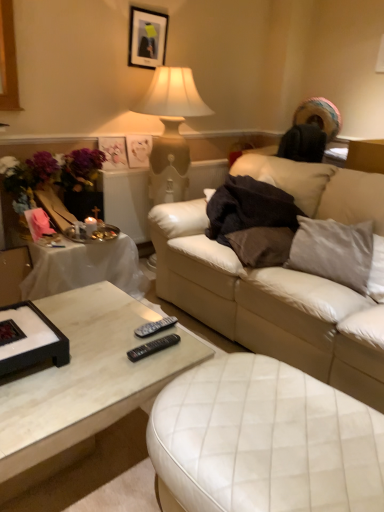
Question: From a real-world perspective, is matte plastic picture frame at upper left, which appears as the 1th picture frame when ordered from the bottom, above or below matte black picture frame at upper center, which ranks as the 3th picture frame in bottom-to-top order?

Choices:
 (A) above
 (B) below

Answer: (B)

Question: Is point (119, 147) closer or farther from the camera than point (139, 46)?

Choices:
 (A) closer
 (B) farther

Answer: (B)

Question: Estimate the real-world distances between objects in this image. Which object is closer to the leather couch at center?

Choices:
 (A) matte white picture frame at upper center, the 2th picture frame when ordered from top to bottom
 (B) white marble coffee table at lower left
 (C) black plastic remote at lower center, the second remote in the back-to-front sequence
 (D) vibrant silk bouquet at left
 (E) black plastic remote at center, which is the 2th remote from front to back

Answer: (B)

Question: Estimate the real-world distances between objects in this image. Which object is farther from the matte white picture frame at upper center, the second picture frame in the bottom-to-top sequence?

Choices:
 (A) vibrant silk bouquet at left
 (B) black plastic remote at center, which is counted as the first remote, starting from the back
 (C) leather couch at center
 (D) matte black picture frame at upper center, which ranks as the 3th picture frame in bottom-to-top order
 (E) satin gray pillow at right

Answer: (B)